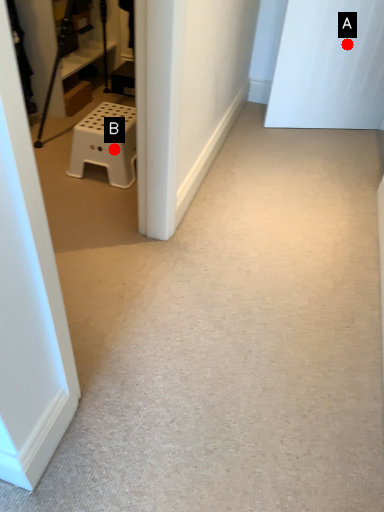
Question: Two points are circled on the image, labeled by A and B beside each circle. Which point is farther from the camera taking this photo?

Choices:
 (A) A is further
 (B) B is further

Answer: (A)